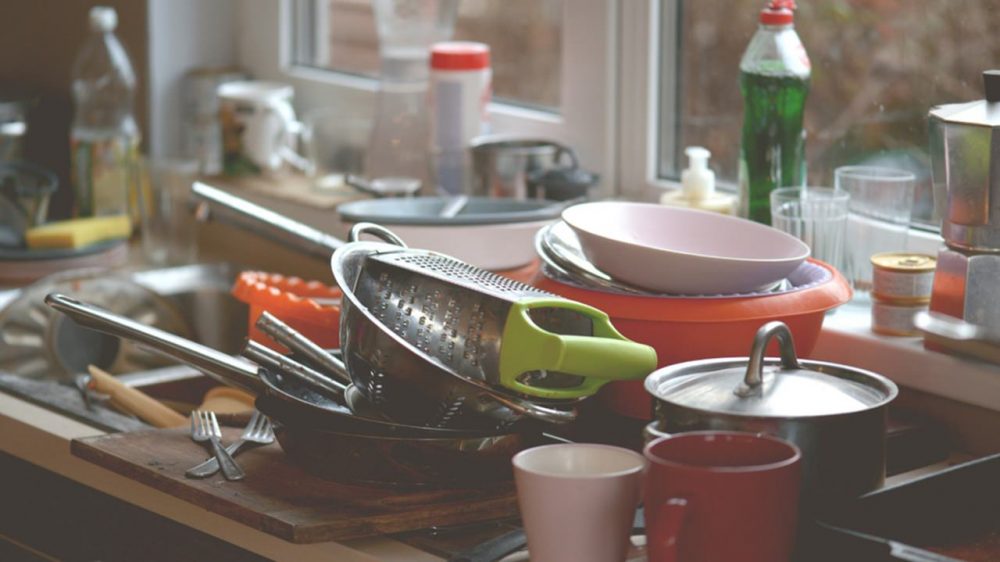
I want to click on cookware, so click(814, 427), click(294, 398), click(351, 455), click(428, 386).